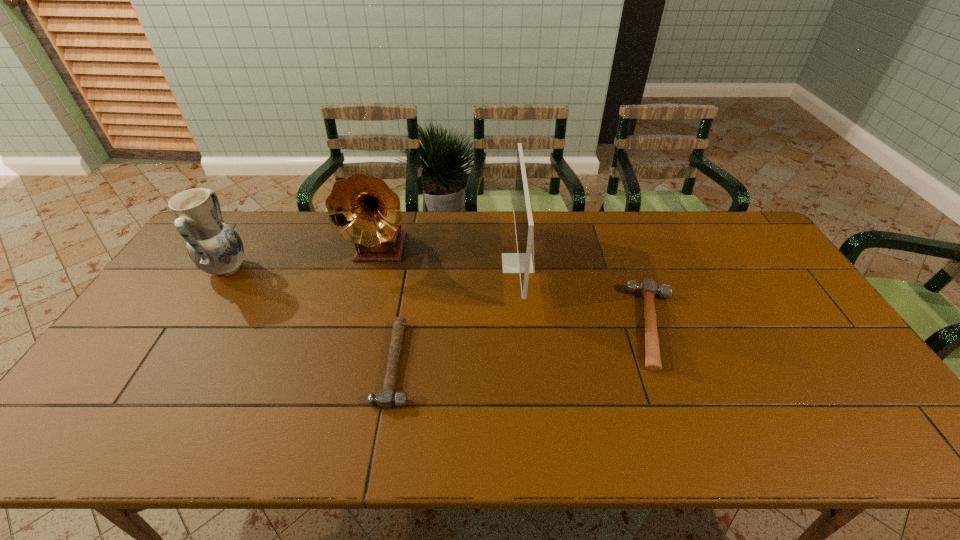
Locate an element on the screen. vacant area in the image that satisfies the following two spatial constraints: 1. on the front-facing side of the monitor; 2. on the right side of the right hammer is located at coordinates (524, 326).